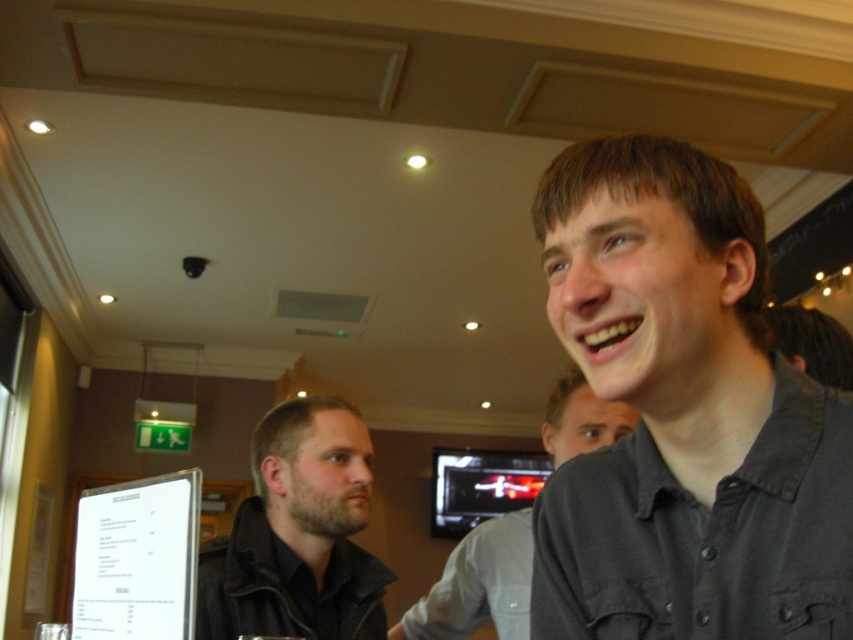
Which is below, dark gray shirt at upper right or gray shirt at upper right?

Positioned lower is gray shirt at upper right.

Describe the element at coordinates (683, 416) in the screenshot. I see `dark gray shirt at upper right` at that location.

Who is more forward, (x=643, y=198) or (x=445, y=616)?

Point (x=643, y=198) is in front.

You are a GUI agent. You are given a task and a screenshot of the screen. Output one action in this format:
    pyautogui.click(x=<x>, y=<y>)
    Task: Click on the dark gray shirt at upper right
    This screenshot has width=853, height=640.
    Given the screenshot: What is the action you would take?
    pyautogui.click(x=683, y=416)

Where is `dark brown leather jacket at center`? The height and width of the screenshot is (640, 853). dark brown leather jacket at center is located at coordinates (297, 534).

Where is `dark brown leather jacket at center`? dark brown leather jacket at center is located at coordinates point(297,534).

Can you confirm if dark gray shirt at upper right is wider than dark brown leather jacket at center?

No.

Which is more to the left, dark gray shirt at upper right or dark brown leather jacket at center?

dark brown leather jacket at center is more to the left.

The width and height of the screenshot is (853, 640). I want to click on dark gray shirt at upper right, so click(683, 416).

Locate an element on the screen. This screenshot has height=640, width=853. dark gray shirt at upper right is located at coordinates (683, 416).